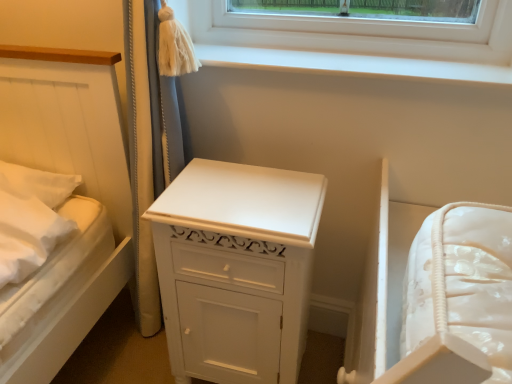
The width and height of the screenshot is (512, 384). What do you see at coordinates (352, 64) in the screenshot?
I see `white smooth window sill at upper center` at bounding box center [352, 64].

This screenshot has width=512, height=384. Identify the location of white smooth window sill at upper center. (352, 64).

You are a GUI agent. You are given a task and a screenshot of the screen. Output one action in this format:
    pyautogui.click(x=<x>, y=<y>)
    Task: Click on the white painted wood chest of drawers at center
    
    Given the screenshot: What is the action you would take?
    pyautogui.click(x=236, y=269)

Image resolution: width=512 pixels, height=384 pixels. Describe the element at coordinates (236, 269) in the screenshot. I see `white painted wood chest of drawers at center` at that location.

At what (x,y) coordinates should I click in order to perform the action: click on white smooth window sill at upper center. Please return your answer as a coordinate pair (x, y). The height and width of the screenshot is (384, 512). Looking at the image, I should click on (352, 64).

Is white painted wood chest of drawers at center to the left of white smooth window sill at upper center from the viewer's perspective?

Yes.

Considering the relative positions of white painted wood chest of drawers at center and white smooth window sill at upper center in the image provided, is white painted wood chest of drawers at center behind white smooth window sill at upper center?

No, it is not.

Between point (292, 310) and point (305, 63), which one is positioned behind?

The point (305, 63) is farther from the camera.

From the image's perspective, is white painted wood chest of drawers at center located beneath white smooth window sill at upper center?

Yes, from the image's perspective, white painted wood chest of drawers at center is below white smooth window sill at upper center.

From a real-world perspective, is white painted wood chest of drawers at center on white smooth window sill at upper center?

Incorrect, from a real-world perspective, white painted wood chest of drawers at center is lower than white smooth window sill at upper center.

Which of these two, white painted wood chest of drawers at center or white smooth window sill at upper center, is wider?

With larger width is white painted wood chest of drawers at center.

In terms of height, does white painted wood chest of drawers at center look taller or shorter compared to white smooth window sill at upper center?

Clearly, white painted wood chest of drawers at center is taller compared to white smooth window sill at upper center.

Considering the relative sizes of white painted wood chest of drawers at center and white smooth window sill at upper center in the image provided, is white painted wood chest of drawers at center bigger than white smooth window sill at upper center?

Indeed, white painted wood chest of drawers at center has a larger size compared to white smooth window sill at upper center.

Is white painted wood chest of drawers at center not within white smooth window sill at upper center?

Yes, white painted wood chest of drawers at center is outside of white smooth window sill at upper center.

Is white painted wood chest of drawers at center positioned far away from white smooth window sill at upper center?

Actually, white painted wood chest of drawers at center and white smooth window sill at upper center are a little close together.

Is white painted wood chest of drawers at center oriented away from white smooth window sill at upper center?

That's not correct — white painted wood chest of drawers at center is not looking away from white smooth window sill at upper center.

How many degrees apart are the facing directions of white painted wood chest of drawers at center and white smooth window sill at upper center?

There is a 1.68-degree angle between the facing directions of white painted wood chest of drawers at center and white smooth window sill at upper center.

Find the location of a particular element. the chest of drawers that is under the white smooth window sill at upper center (from a real-world perspective) is located at coordinates pyautogui.click(x=236, y=269).

Which is more to the left, white smooth window sill at upper center or white painted wood chest of drawers at center?

From the viewer's perspective, white painted wood chest of drawers at center appears more on the left side.

Is the position of white smooth window sill at upper center less distant than that of white painted wood chest of drawers at center?

No, it is behind white painted wood chest of drawers at center.

Is point (323, 68) closer to camera compared to point (268, 269)?

No, (323, 68) is behind (268, 269).

From the picture: From the image's perspective, which is above, white smooth window sill at upper center or white painted wood chest of drawers at center?

white smooth window sill at upper center, from the image's perspective.

From a real-world perspective, which object rests below the other?

white painted wood chest of drawers at center, from a real-world perspective.

Considering the sizes of objects white smooth window sill at upper center and white painted wood chest of drawers at center in the image provided, who is thinner, white smooth window sill at upper center or white painted wood chest of drawers at center?

white smooth window sill at upper center.

Does white smooth window sill at upper center have a lesser height compared to white painted wood chest of drawers at center?

Yes, white smooth window sill at upper center is shorter than white painted wood chest of drawers at center.

Considering the relative sizes of white smooth window sill at upper center and white painted wood chest of drawers at center in the image provided, is white smooth window sill at upper center smaller than white painted wood chest of drawers at center?

Yes.

Is white painted wood chest of drawers at center located within white smooth window sill at upper center?

No, white painted wood chest of drawers at center is not surrounded by white smooth window sill at upper center.

Is white smooth window sill at upper center not near white painted wood chest of drawers at center?

white smooth window sill at upper center is actually quite close to white painted wood chest of drawers at center.

Does white smooth window sill at upper center turn towards white painted wood chest of drawers at center?

No, white smooth window sill at upper center is not facing towards white painted wood chest of drawers at center.

You are a GUI agent. You are given a task and a screenshot of the screen. Output one action in this format:
    pyautogui.click(x=<x>, y=<y>)
    Task: Click on the window sill that is above the white painted wood chest of drawers at center (from a real-world perspective)
    Image resolution: width=512 pixels, height=384 pixels.
    Given the screenshot: What is the action you would take?
    pyautogui.click(x=352, y=64)

At what (x,y) coordinates should I click in order to perform the action: click on window sill behind the white painted wood chest of drawers at center. Please return your answer as a coordinate pair (x, y). The image size is (512, 384). Looking at the image, I should click on (352, 64).

At what (x,y) coordinates should I click in order to perform the action: click on window sill to the right of white painted wood chest of drawers at center. Please return your answer as a coordinate pair (x, y). Image resolution: width=512 pixels, height=384 pixels. Looking at the image, I should click on (352, 64).